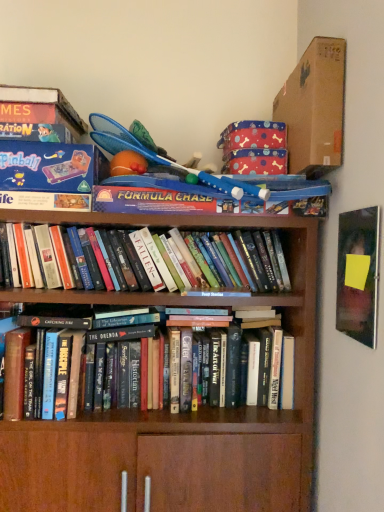
Question: Is matte black book at upper right not near blue plastic toy at upper center?

Choices:
 (A) yes
 (B) no

Answer: (B)

Question: Can you confirm if matte black book at upper right is smaller than blue plastic toy at upper center?

Choices:
 (A) yes
 (B) no

Answer: (A)

Question: Considering the relative sizes of matte black book at upper right and blue plastic toy at upper center in the image provided, is matte black book at upper right bigger than blue plastic toy at upper center?

Choices:
 (A) no
 (B) yes

Answer: (A)

Question: From a real-world perspective, is matte black book at upper right located beneath blue plastic toy at upper center?

Choices:
 (A) yes
 (B) no

Answer: (A)

Question: From the image's perspective, is matte black book at upper right over blue plastic toy at upper center?

Choices:
 (A) no
 (B) yes

Answer: (A)

Question: From the image's perspective, is blue plastic toy at upper center above or below brown cardboard box at upper right?

Choices:
 (A) below
 (B) above

Answer: (A)

Question: Looking at their shapes, would you say blue plastic toy at upper center is wider or thinner than brown cardboard box at upper right?

Choices:
 (A) wide
 (B) thin

Answer: (A)

Question: In terms of height, does blue plastic toy at upper center look taller or shorter compared to brown cardboard box at upper right?

Choices:
 (A) short
 (B) tall

Answer: (A)

Question: In the image, is blue plastic toy at upper center on the left side or the right side of brown cardboard box at upper right?

Choices:
 (A) right
 (B) left

Answer: (B)

Question: Considering their positions, is brown cardboard box at upper right located in front of or behind hardcover books at center, placed as the 2th book when sorted from bottom to top?

Choices:
 (A) behind
 (B) front

Answer: (B)

Question: From a real-world perspective, is brown cardboard box at upper right above or below hardcover books at center, placed as the 2th book when sorted from bottom to top?

Choices:
 (A) below
 (B) above

Answer: (B)

Question: Is brown cardboard box at upper right wider or thinner than hardcover books at center, placed as the 2th book when sorted from bottom to top?

Choices:
 (A) thin
 (B) wide

Answer: (B)

Question: Considering the positions of point (334, 144) and point (281, 259), is point (334, 144) closer or farther from the camera than point (281, 259)?

Choices:
 (A) farther
 (B) closer

Answer: (B)

Question: From a real-world perspective, is matte black book at upper right positioned above or below brown cardboard box at upper right?

Choices:
 (A) above
 (B) below

Answer: (B)

Question: In the image, is matte black book at upper right on the left side or the right side of brown cardboard box at upper right?

Choices:
 (A) right
 (B) left

Answer: (A)